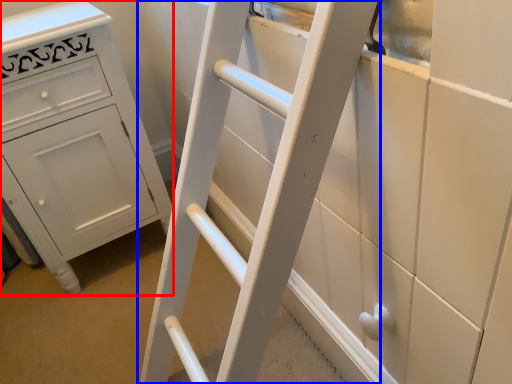
Question: Which of the following is the closest to the observer, chest of drawers (highlighted by a red box) or ladder (highlighted by a blue box)?

Choices:
 (A) chest of drawers
 (B) ladder

Answer: (B)